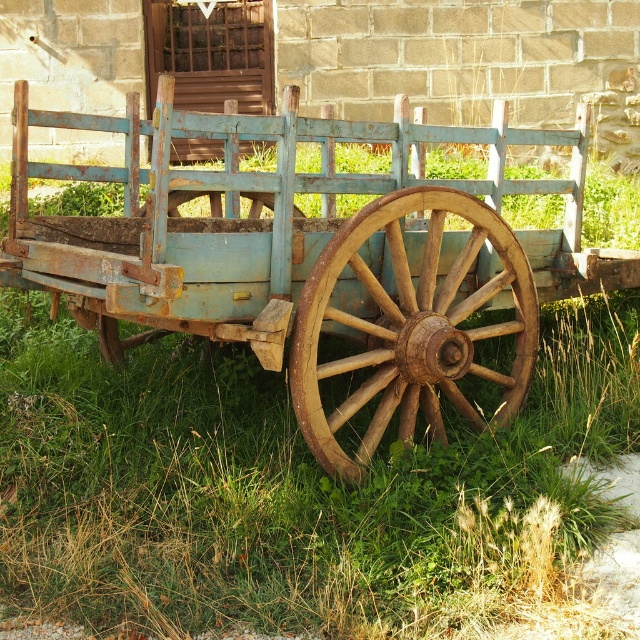
Based on the photo, you are standing in the field next to the stone building and see the rusty wood wagon at center and the rusty wood wagon wheel at center. Which object is directly above the other?

The rusty wood wagon at center is positioned over the rusty wood wagon wheel at center, so the wagon is directly above the wheel.

You are standing in front of the old wooden cart and want to determine the position of two points marked on its surface. Which point is closer to you, point (346, 470) or point (403, 291)?

Point (346, 470) is closer to the camera than point (403, 291).

You are standing at the center of the image. Which object is located exactly at the point with coordinates [320,264]?

The rusty wood wagon at center is located exactly at the point with coordinates [320,264].